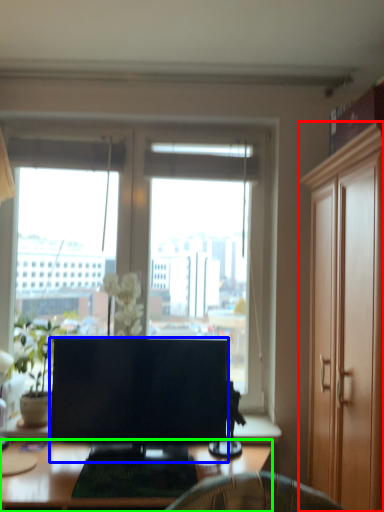
Question: Which object is the closest to the cabinetry (highlighted by a red box)? Choose among these: television (highlighted by a blue box) or desk (highlighted by a green box).

Choices:
 (A) television
 (B) desk

Answer: (A)